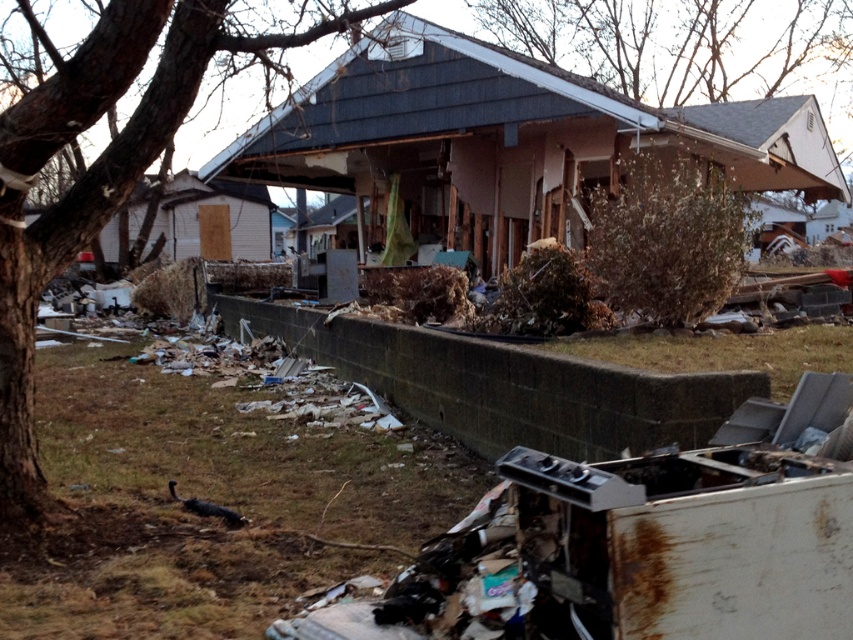
Question: Is brown rough bark tree at left below bare branches at upper center?

Choices:
 (A) yes
 (B) no

Answer: (A)

Question: Among these points, which one is farthest from the camera?

Choices:
 (A) (178, 35)
 (B) (743, 17)

Answer: (B)

Question: Does brown rough bark tree at left appear over bare branches at upper center?

Choices:
 (A) yes
 (B) no

Answer: (B)

Question: Which point is farther from the camera taking this photo?

Choices:
 (A) (135, 8)
 (B) (598, 3)

Answer: (B)

Question: Can you confirm if brown rough bark tree at left is positioned above bare branches at upper center?

Choices:
 (A) yes
 (B) no

Answer: (B)